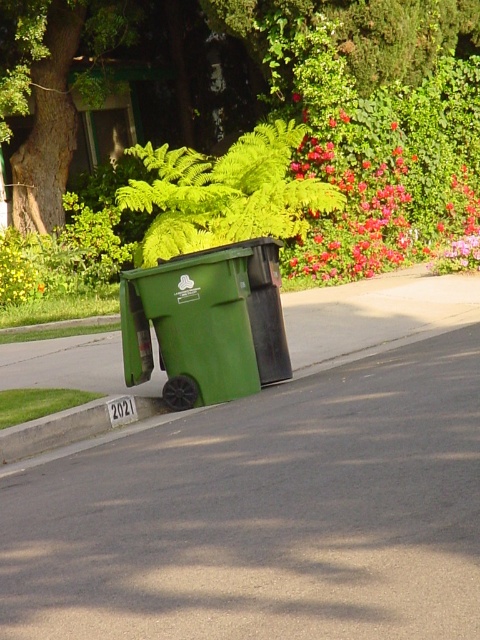
Measure the distance between green matte recycling bin at center and yellow matte flower at upper left.

green matte recycling bin at center is 8.90 meters away from yellow matte flower at upper left.

Does green matte recycling bin at center have a smaller size compared to yellow matte flower at upper left?

Yes.

The image size is (480, 640). Find the location of `green matte recycling bin at center`. green matte recycling bin at center is located at coordinates (191, 326).

I want to click on green matte recycling bin at center, so click(x=191, y=326).

Is green leafy fern at center smaller than yellow matte flower at upper left?

Incorrect, green leafy fern at center is not smaller in size than yellow matte flower at upper left.

Is green leafy fern at center taller than yellow matte flower at upper left?

Correct, green leafy fern at center is much taller as yellow matte flower at upper left.

Between point (180, 150) and point (33, 266), which one is positioned in front?

Point (180, 150) is in front.

Where is `green leafy fern at center`? green leafy fern at center is located at coordinates (226, 193).

Between point (368, 58) and point (26, 275), which one is positioned in front?

Point (368, 58) is in front.

Is the position of green leafy tree at upper center more distant than that of yellow matte flower at upper left?

That is False.

Identify the location of green leafy tree at upper center. The height and width of the screenshot is (640, 480). (52, 88).